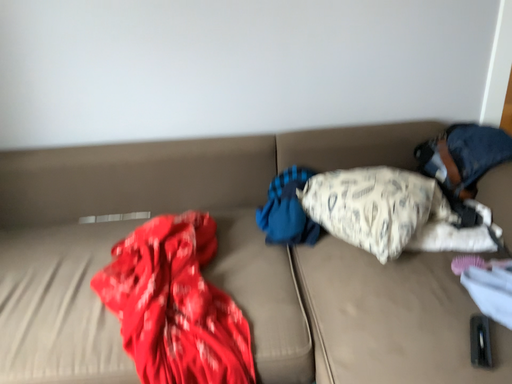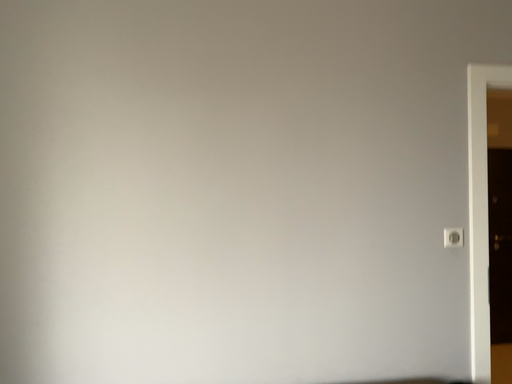
Question: Which way did the camera rotate in the video?

Choices:
 (A) rotated downward
 (B) rotated upward

Answer: (B)